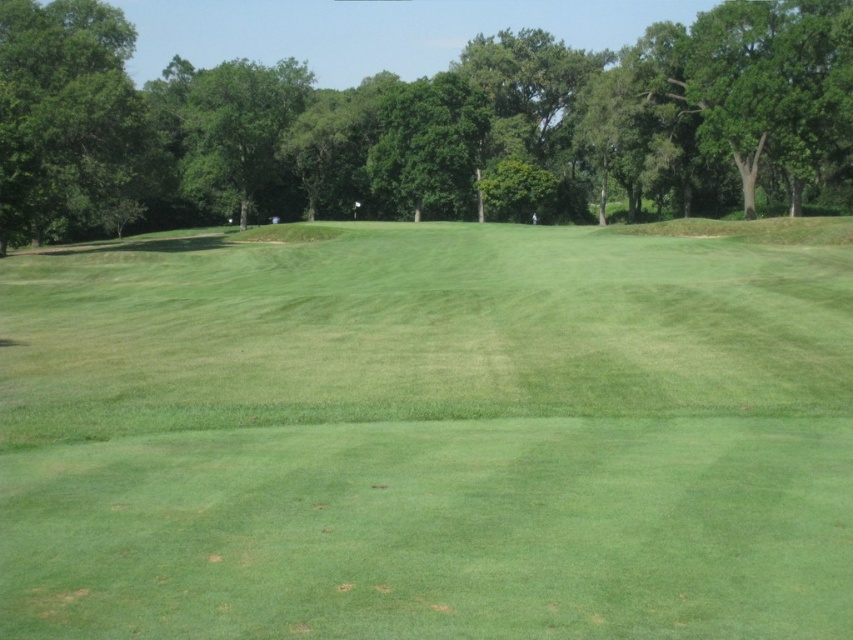
You are a golfer standing on the green grassy field at center. You want to hit a ball to the green leafy tree at upper center. Which object is closer to you?

The green grassy field at center is closer to you since it is the surface you are standing on, while the green leafy tree at upper center is farther away in the distance.

You are a golfer standing at the tee box preparing to hit your ball towards the green. You notice two green leafy tree obstacles in your path. The first is the green leafy tree at upper center, and the second is the green leafy tree at left. Which tree is closer to your current position?

The green leafy tree at left is closer to your current position because it is positioned to the left side of the green leafy tree at upper center, which is further away in the upper part of the scene.

You are standing on the golf course and want to walk from point A to point B. Point A is at coordinate point (477, 141) and point B is at coordinate point (25, 26). Which point should you start walking from if you want to go towards the background of the image?

You should start walking from point (25, 26) because it is closer to the background of the image compared to point (477, 141), which is closer to the viewer.